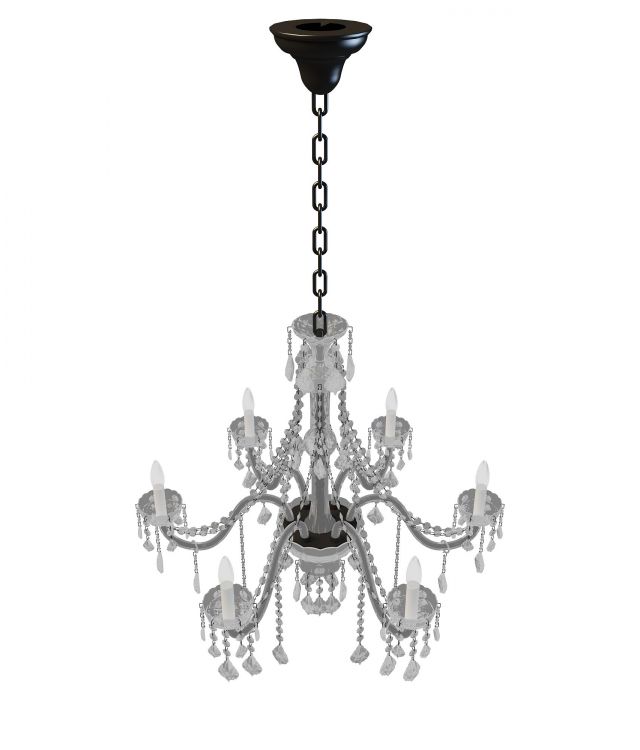
Find the location of a particular element. Image resolution: width=640 pixels, height=750 pixels. light holder is located at coordinates (173, 505), (242, 429), (401, 430), (470, 508), (422, 620), (212, 616).